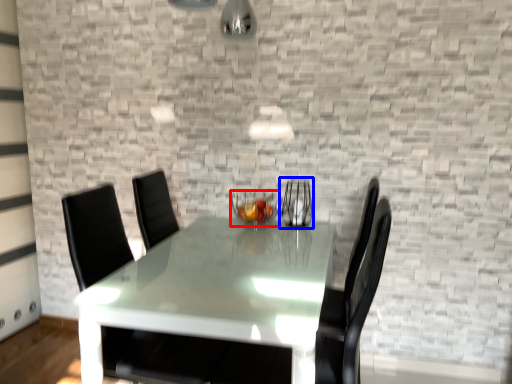
Question: Which object appears closest to the camera in this image, candle holder (highlighted by a red box) or glass vase (highlighted by a blue box)?

Choices:
 (A) candle holder
 (B) glass vase

Answer: (A)